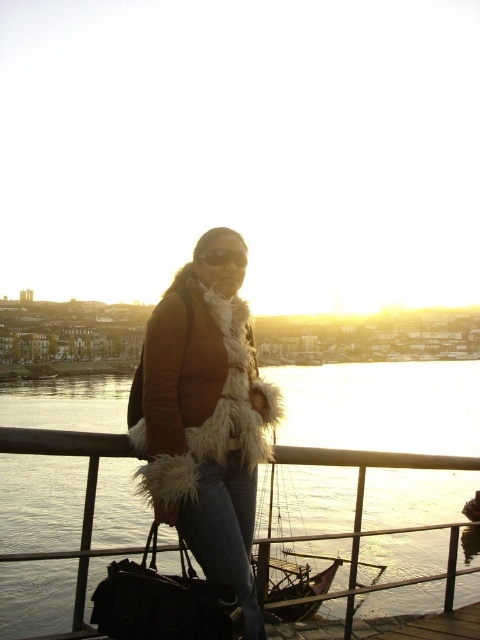
Question: Considering the real-world distances, which object is farthest from the fuzzy brown coat at center?

Choices:
 (A) black leather bag at lower left
 (B) sunglasses at center

Answer: (A)

Question: Does fuzzy brown coat at center appear on the right side of sunglasses at center?

Choices:
 (A) yes
 (B) no

Answer: (B)

Question: Among these points, which one is nearest to the camera?

Choices:
 (A) (213, 256)
 (B) (122, 612)
 (C) (288, 524)
 (D) (176, 458)

Answer: (B)

Question: Does fuzzy brown coat at center appear on the left side of sunglasses at center?

Choices:
 (A) yes
 (B) no

Answer: (A)

Question: Is fuzzy brown coat at center wider than black leather bag at lower left?

Choices:
 (A) no
 (B) yes

Answer: (B)

Question: Estimate the real-world distances between objects in this image. Which object is farther from the fuzzy brown coat at center?

Choices:
 (A) black leather bag at lower left
 (B) sunglasses at center
 (C) shiny metallic water at center

Answer: (C)